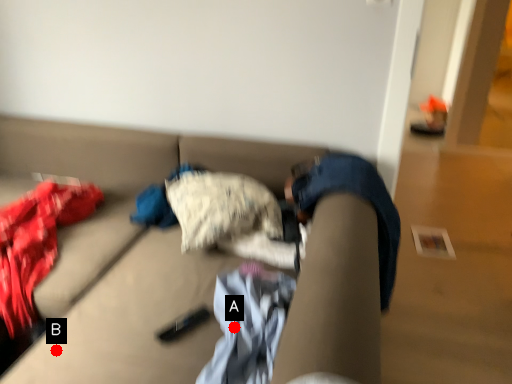
Question: Two points are circled on the image, labeled by A and B beside each circle. Which of the following is the closest to the observer?

Choices:
 (A) A is closer
 (B) B is closer

Answer: (B)